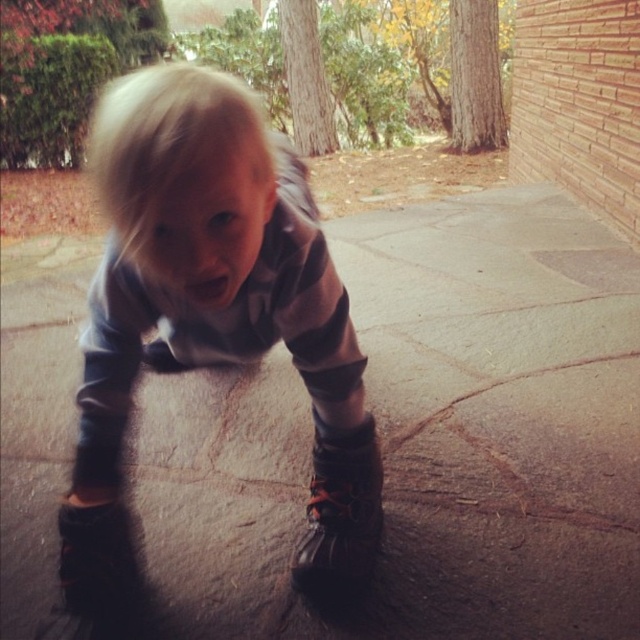
Is brown stone pavement at center to the left of black leather boot at lower center from the viewer's perspective?

Correct, you'll find brown stone pavement at center to the left of black leather boot at lower center.

This screenshot has width=640, height=640. In order to click on brown stone pavement at center in this screenshot , I will do `click(422, 440)`.

Can you confirm if gray fleece hoodie at center is positioned above black leather boot at lower center?

Yes.

The image size is (640, 640). Find the location of `gray fleece hoodie at center`. gray fleece hoodie at center is located at coordinates (212, 305).

In the scene shown: Does black leather boot at lower center appear on the left side of leather boot at lower left?

No, black leather boot at lower center is not to the left of leather boot at lower left.

Which is behind, point (308, 496) or point (116, 579)?

The point (308, 496) is more distant.

At what (x,y) coordinates should I click in order to perform the action: click on black leather boot at lower center. Please return your answer as a coordinate pair (x, y). This screenshot has width=640, height=640. Looking at the image, I should click on pos(340,513).